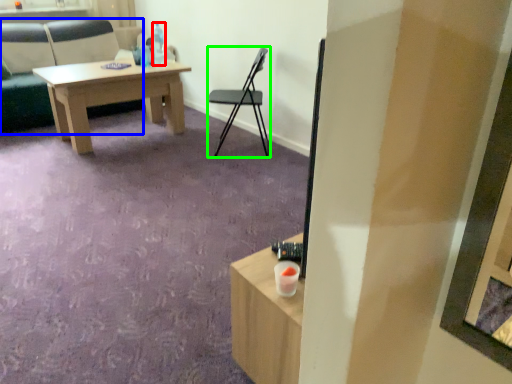
Question: Estimate the real-world distances between objects in this image. Which object is closer to bottle (highlighted by a red box), chair (highlighted by a blue box) or chair (highlighted by a green box)?

Choices:
 (A) chair
 (B) chair

Answer: (B)